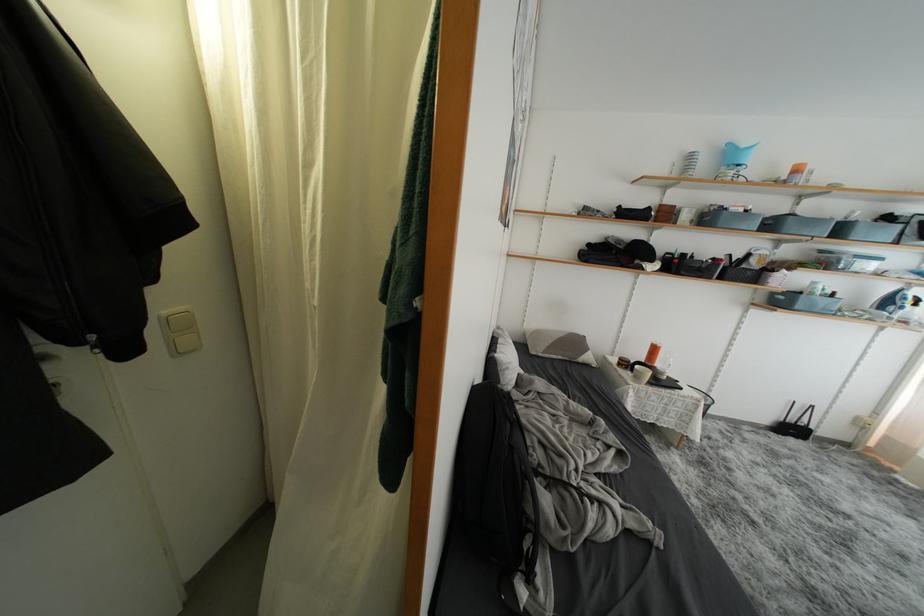
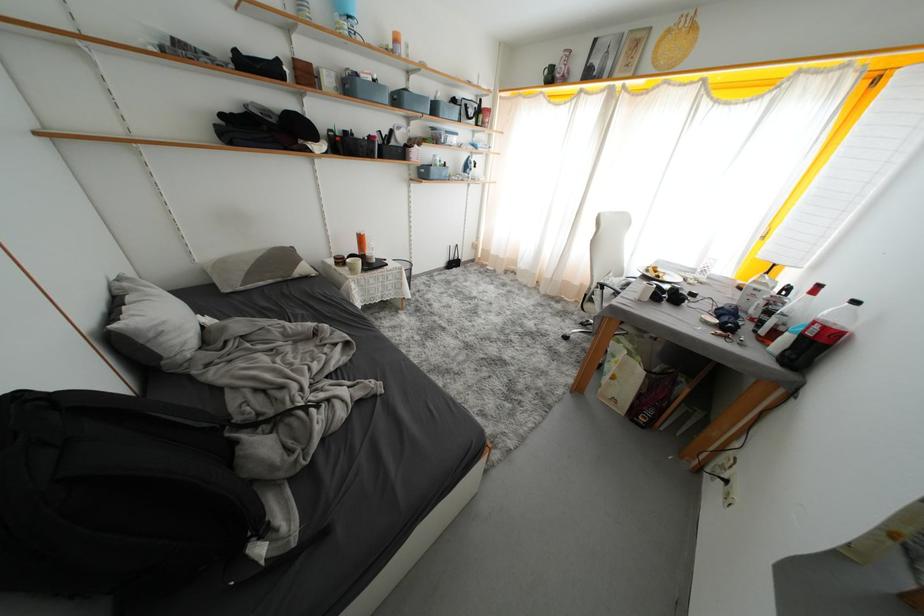
Locate, in the second image, the point that corresponds to point 777,229 in the first image.

(404, 103)